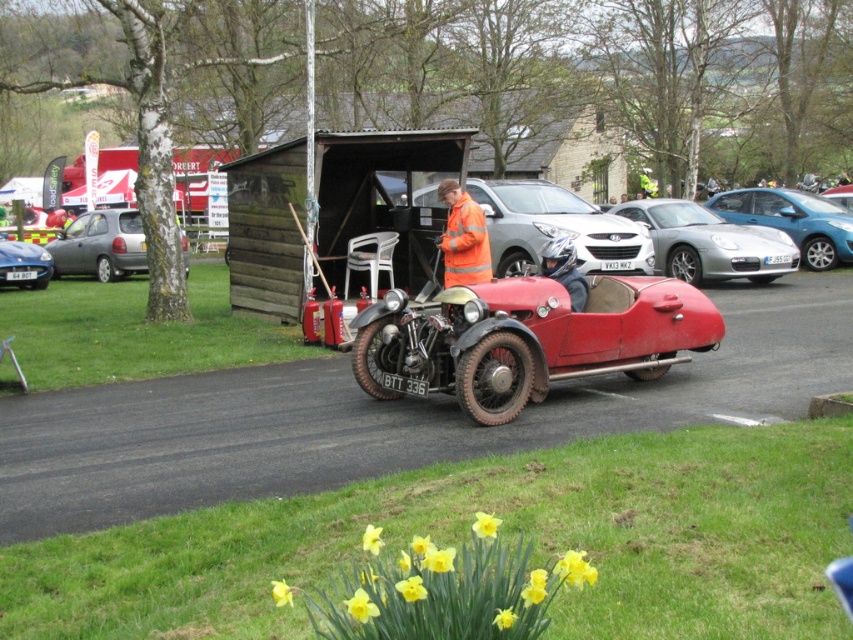
Question: Does yellow matte daffodil at lower center appear over silver metallic hatchback at left?

Choices:
 (A) yes
 (B) no

Answer: (B)

Question: Which of the following is the closest to the observer?

Choices:
 (A) (16, 268)
 (B) (669, 275)

Answer: (B)

Question: Which point is farther to the camera?

Choices:
 (A) yellow matte daffodil at lower center
 (B) matte black car at left
 (C) high visibility orange jacket at center
 (D) metallic silver car at center

Answer: (B)

Question: Can you confirm if yellow matte daffodil at lower center is smaller than silver metallic car at center?

Choices:
 (A) no
 (B) yes

Answer: (B)

Question: From the image, what is the correct spatial relationship of yellow matte daffodil at lower center in relation to high visibility orange jacket at center?

Choices:
 (A) left
 (B) right

Answer: (A)

Question: Which of the following is the farthest from the observer?

Choices:
 (A) (129, 273)
 (B) (495, 612)

Answer: (A)